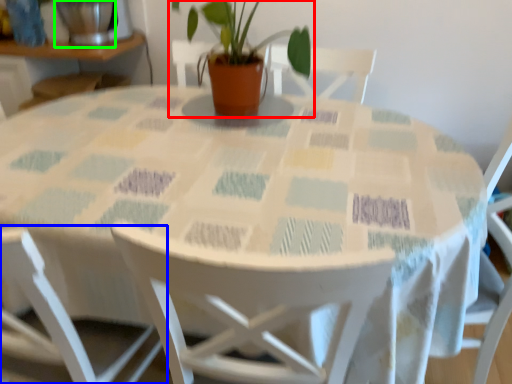
Question: Which is nearer to the houseplant (highlighted by a red box)? chair (highlighted by a blue box) or glass vase (highlighted by a green box).

Choices:
 (A) chair
 (B) glass vase

Answer: (B)